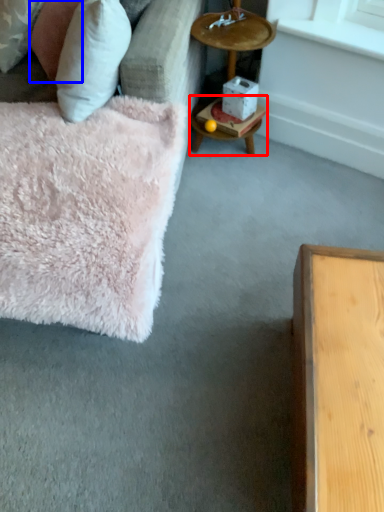
Question: Among these objects, which one is farthest to the camera, table (highlighted by a red box) or pillow (highlighted by a blue box)?

Choices:
 (A) table
 (B) pillow

Answer: (A)